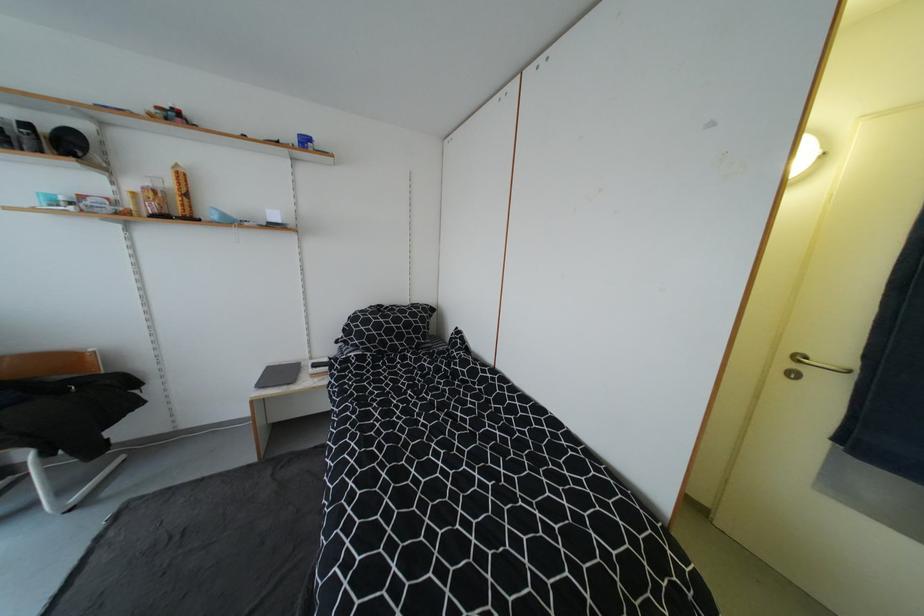
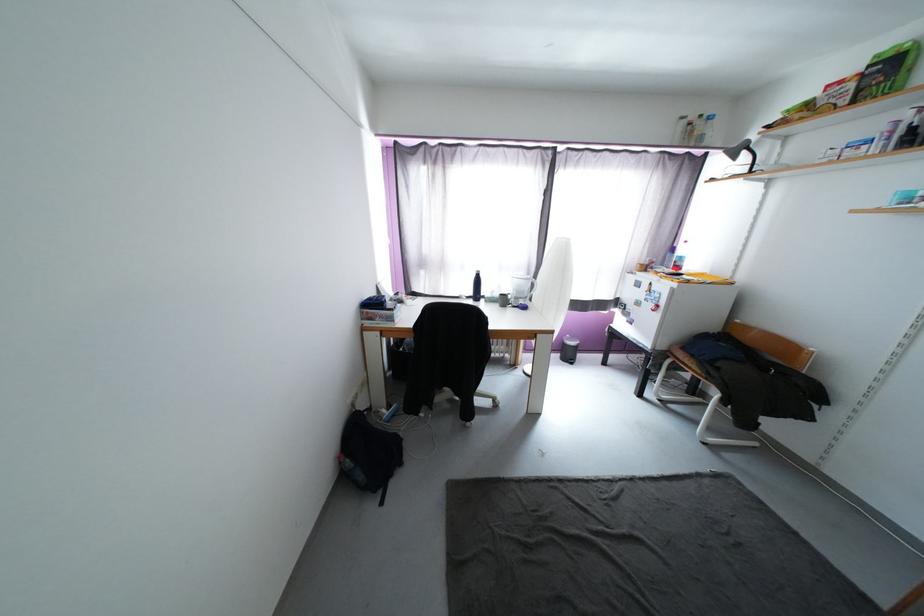
Locate, in the second image, the point that corresponds to pixel 144 405 in the first image.

(812, 419)